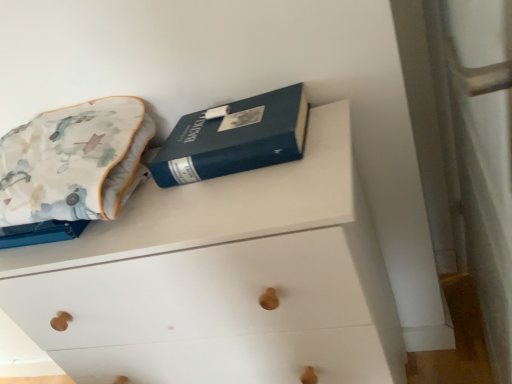
Question: From the image's perspective, is fluffy cotton throw pillow at upper left located above or below white matte chest of drawers at upper center?

Choices:
 (A) below
 (B) above

Answer: (B)

Question: Is fluffy cotton throw pillow at upper left wider or thinner than white matte chest of drawers at upper center?

Choices:
 (A) wide
 (B) thin

Answer: (B)

Question: Estimate the real-world distances between objects in this image. Which object is closer to the blue hardcover book at upper center?

Choices:
 (A) white matte chest of drawers at upper center
 (B) fluffy cotton throw pillow at upper left

Answer: (A)

Question: Considering the real-world distances, which object is farthest from the white matte chest of drawers at upper center?

Choices:
 (A) fluffy cotton throw pillow at upper left
 (B) blue hardcover book at upper center

Answer: (A)